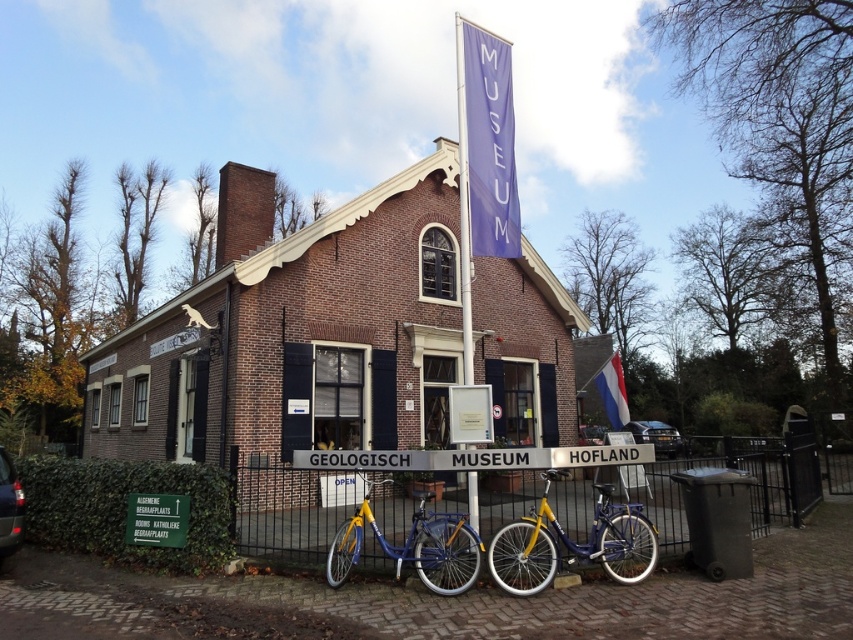
You are standing at the entrance of the GEOLOGISCH MUSEUM HOFLAND and want to park your bicycle exactly 4 meters away from the blue fabric banner at upper center. Can you park your blue matte bicycle at center at the current location?

The blue fabric banner at upper center is 3.82 meters from the blue matte bicycle at center. Since 3.82 meters is less than 4 meters, the bicycle is too close. Move it further away to meet the 4 meter requirement.

You are standing in front of the GEOLOGISCH MUSEUM HOFLAND and want to locate the entrance. You see a blue fabric banner at upper center and a blue matte bicycle at center. Which object is closer to the entrance sign?

The blue fabric banner at upper center is closer to the entrance sign because it is positioned to the right of the blue matte bicycle at center, which is further away from the entrance.

You are a visitor standing at the entrance of the GEOLOGISCH MUSEUM HOFLAND. You see a blue matte bicycle at center and a purple fabric banner at center. If you want to take a photo that includes both objects in the frame, would you need to zoom in or zoom out your camera?

The blue matte bicycle at center and purple fabric banner at center are 5.95 meters apart from each other. To include both in the frame, you would need to zoom out to widen the field of view.